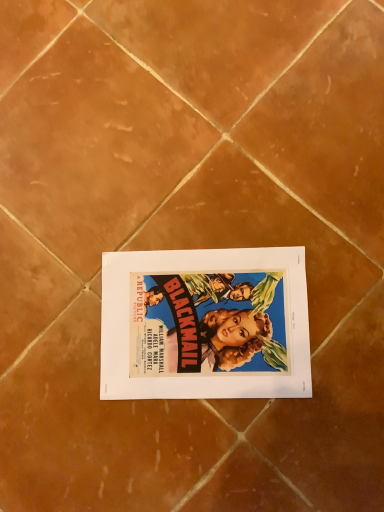
What do you see at coordinates (205, 324) in the screenshot?
I see `vibrant paper poster at center` at bounding box center [205, 324].

You are a GUI agent. You are given a task and a screenshot of the screen. Output one action in this format:
    pyautogui.click(x=<x>, y=<y>)
    Task: Click on the vibrant paper poster at center
    
    Given the screenshot: What is the action you would take?
    pyautogui.click(x=205, y=324)

What are the coordinates of `vibrant paper poster at center` in the screenshot? It's located at (205, 324).